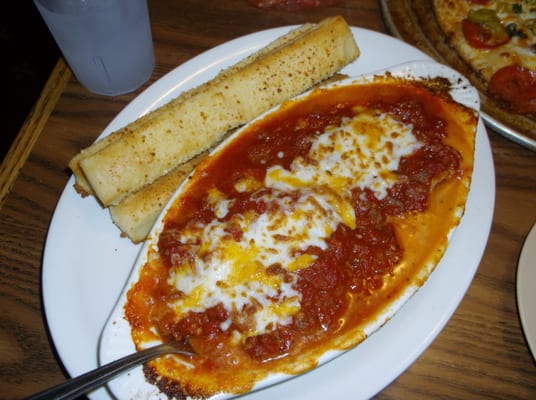
The width and height of the screenshot is (536, 400). Identify the location of oval white serving plate. (100, 290).